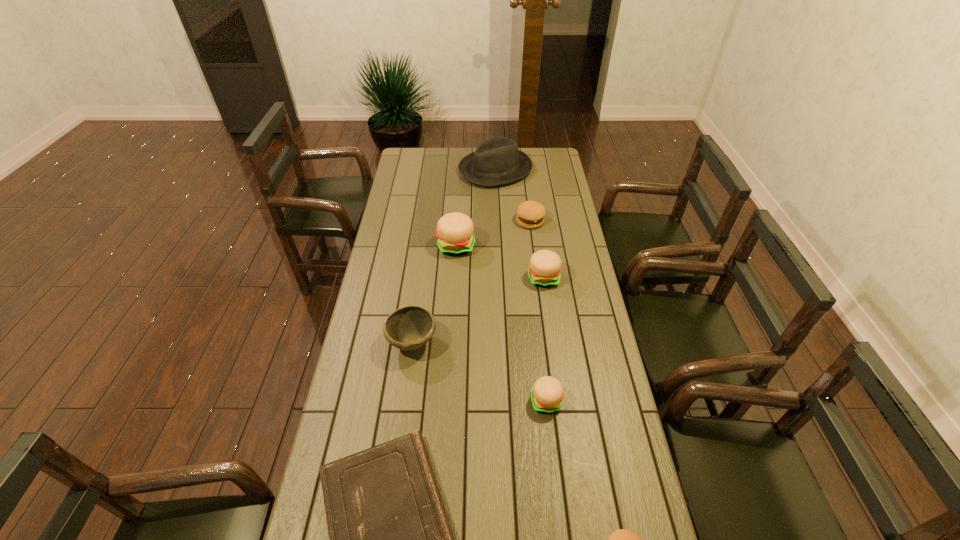
Where is `fedora`? The image size is (960, 540). fedora is located at coordinates (496, 161).

At what (x,y) coordinates should I click in order to perform the action: click on the farthest object. Please return your answer as a coordinate pair (x, y). Looking at the image, I should click on (496, 161).

I want to click on the tallest hamburger, so click(454, 230).

Where is `the leftmost hamburger`? The image size is (960, 540). the leftmost hamburger is located at coordinates (454, 230).

Find the location of `the fourth farthest object`. the fourth farthest object is located at coordinates (545, 266).

Where is `the second biggest beige hamburger`? The width and height of the screenshot is (960, 540). the second biggest beige hamburger is located at coordinates (545, 266).

This screenshot has width=960, height=540. In order to click on bowl in this screenshot , I will do `click(408, 328)`.

Locate an element on the screen. the farthest hamburger is located at coordinates (530, 214).

The height and width of the screenshot is (540, 960). Find the location of `the farther brown hamburger`. the farther brown hamburger is located at coordinates (530, 214).

You are a GUI agent. You are given a task and a screenshot of the screen. Output one action in this format:
    pyautogui.click(x=<x>, y=<y>)
    Task: Click on the second nearest hamburger
    This screenshot has height=540, width=960.
    Given the screenshot: What is the action you would take?
    [547, 394]